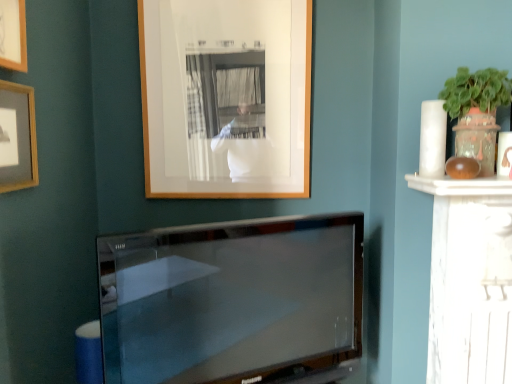
Question: From a real-world perspective, is wooden picture frame at upper center, arranged as the first picture frame when viewed from the right, physically below matte wooden picture frame at upper left, which ranks as the second picture frame in back-to-front order?

Choices:
 (A) no
 (B) yes

Answer: (A)

Question: Can you confirm if wooden picture frame at upper center, which appears as the 3th picture frame when viewed from the left, is bigger than matte wooden picture frame at upper left, positioned as the 1th picture frame in left-to-right order?

Choices:
 (A) yes
 (B) no

Answer: (A)

Question: From the image's perspective, is wooden picture frame at upper center, which appears as the 3th picture frame when viewed from the left, above matte wooden picture frame at upper left, which is the third picture frame in right-to-left order?

Choices:
 (A) yes
 (B) no

Answer: (A)

Question: Does wooden picture frame at upper center, arranged as the first picture frame when viewed from the right, turn towards matte wooden picture frame at upper left, which is the third picture frame in right-to-left order?

Choices:
 (A) yes
 (B) no

Answer: (A)

Question: From the image's perspective, is wooden picture frame at upper center, positioned as the third picture frame in front-to-back order, beneath matte wooden picture frame at upper left, which is the third picture frame in right-to-left order?

Choices:
 (A) yes
 (B) no

Answer: (B)

Question: Can you confirm if wooden picture frame at upper center, which appears as the 3th picture frame when viewed from the left, is shorter than matte wooden picture frame at upper left, which ranks as the second picture frame in back-to-front order?

Choices:
 (A) no
 (B) yes

Answer: (A)

Question: Can you confirm if satin black tv at center is wider than matte wooden picture frame at upper left, which is the third picture frame in right-to-left order?

Choices:
 (A) yes
 (B) no

Answer: (A)

Question: Does satin black tv at center have a lesser width compared to matte wooden picture frame at upper left, positioned as the 1th picture frame in left-to-right order?

Choices:
 (A) no
 (B) yes

Answer: (A)

Question: Is satin black tv at center taller than matte wooden picture frame at upper left, positioned as the 1th picture frame in left-to-right order?

Choices:
 (A) yes
 (B) no

Answer: (A)

Question: Could you tell me if satin black tv at center is turned towards matte wooden picture frame at upper left, which ranks as the second picture frame in back-to-front order?

Choices:
 (A) no
 (B) yes

Answer: (A)

Question: Does satin black tv at center come behind matte wooden picture frame at upper left, which ranks as the second picture frame in back-to-front order?

Choices:
 (A) no
 (B) yes

Answer: (B)

Question: From the image's perspective, does satin black tv at center appear lower than matte wooden picture frame at upper left, the second picture frame positioned from the front?

Choices:
 (A) no
 (B) yes

Answer: (B)

Question: From the image's perspective, is wooden picture frame at upper center, arranged as the first picture frame when viewed from the right, on satin black tv at center?

Choices:
 (A) no
 (B) yes

Answer: (B)